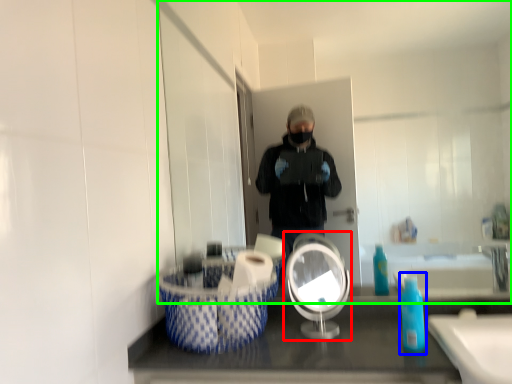
Question: Based on their relative distances, which object is nearer to mirror (highlighted by a red box)? Choose from soap dispenser (highlighted by a blue box) and mirror (highlighted by a green box).

Choices:
 (A) soap dispenser
 (B) mirror

Answer: (A)